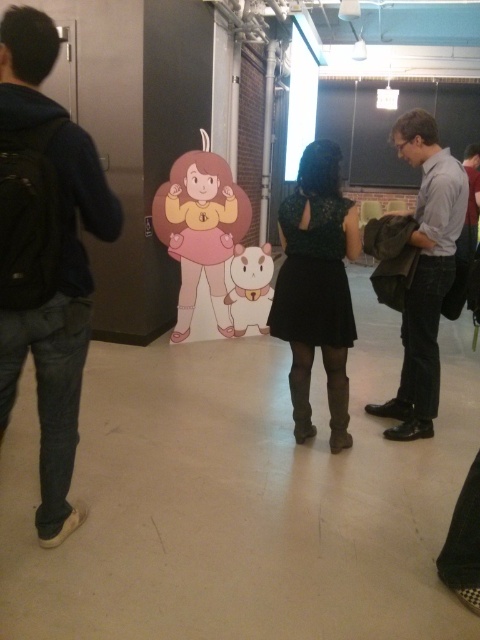
Question: Which object is farther from the camera taking this photo?

Choices:
 (A) green lace dress at center
 (B) black backpack at left

Answer: (A)

Question: Can you confirm if black backpack at left is bigger than green lace dress at center?

Choices:
 (A) yes
 (B) no

Answer: (A)

Question: Which point is farther to the camera?

Choices:
 (A) dark gray fabric jacket at right
 (B) green lace dress at center
 (C) black backpack at left

Answer: (A)

Question: Does dark gray fabric jacket at right appear on the right side of green lace dress at center?

Choices:
 (A) yes
 (B) no

Answer: (A)

Question: Does dark gray fabric jacket at right have a lesser width compared to green lace dress at center?

Choices:
 (A) yes
 (B) no

Answer: (B)

Question: Which point is closer to the camera?

Choices:
 (A) (304, 410)
 (B) (38, 508)

Answer: (B)